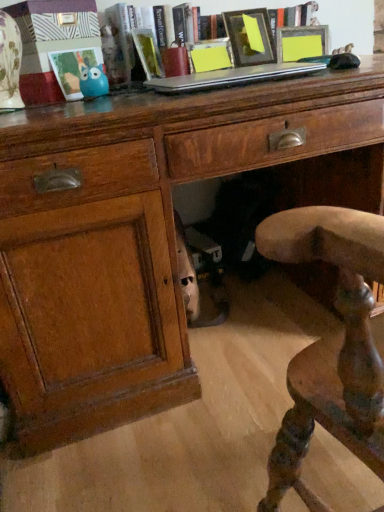
Question: Does matte black picture frame at upper center, acting as the first picture frame starting from the right, have a lesser width compared to silver metallic laptop at upper center?

Choices:
 (A) yes
 (B) no

Answer: (A)

Question: Is matte black picture frame at upper center, acting as the first picture frame starting from the right, to the right of silver metallic laptop at upper center from the viewer's perspective?

Choices:
 (A) yes
 (B) no

Answer: (A)

Question: Considering the relative positions of matte black picture frame at upper center, acting as the first picture frame starting from the right, and silver metallic laptop at upper center in the image provided, is matte black picture frame at upper center, acting as the first picture frame starting from the right, in front of silver metallic laptop at upper center?

Choices:
 (A) yes
 (B) no

Answer: (B)

Question: From the image's perspective, is matte black picture frame at upper center, acting as the first picture frame starting from the right, below silver metallic laptop at upper center?

Choices:
 (A) no
 (B) yes

Answer: (A)

Question: Does matte black picture frame at upper center, acting as the first picture frame starting from the right, have a greater height compared to silver metallic laptop at upper center?

Choices:
 (A) no
 (B) yes

Answer: (B)

Question: Is point (153, 57) closer or farther from the camera than point (208, 66)?

Choices:
 (A) closer
 (B) farther

Answer: (B)

Question: Considering the relative positions of hardcover book at center, positioned as the 2th book in right-to-left order, and matte yellow picture frame at center, which is the second picture frame from left to right, in the image provided, is hardcover book at center, positioned as the 2th book in right-to-left order, to the left or to the right of matte yellow picture frame at center, which is the second picture frame from left to right,?

Choices:
 (A) left
 (B) right

Answer: (A)

Question: From the image's perspective, is hardcover book at center, acting as the first book starting from the left, positioned above or below matte yellow picture frame at center, which is the second picture frame from left to right?

Choices:
 (A) above
 (B) below

Answer: (A)

Question: In terms of width, does hardcover book at center, positioned as the 2th book in right-to-left order, look wider or thinner when compared to matte yellow picture frame at center, which is the second picture frame from left to right?

Choices:
 (A) wide
 (B) thin

Answer: (A)

Question: Is point pos(241,44) closer or farther from the camera than point pos(97,48)?

Choices:
 (A) farther
 (B) closer

Answer: (A)

Question: From the image's perspective, is matte black picture frame at upper center, acting as the first picture frame starting from the right, positioned above or below matte plastic picture frame at upper left, the 3th picture frame from the right?

Choices:
 (A) below
 (B) above

Answer: (B)

Question: In terms of height, does matte black picture frame at upper center, acting as the first picture frame starting from the right, look taller or shorter compared to matte plastic picture frame at upper left, placed as the first picture frame when sorted from left to right?

Choices:
 (A) short
 (B) tall

Answer: (B)

Question: Visually, is matte black picture frame at upper center, which appears as the third picture frame when viewed from the left, positioned to the left or to the right of matte plastic picture frame at upper left, the 3th picture frame from the right?

Choices:
 (A) left
 (B) right

Answer: (B)

Question: Relative to matte yellow picture frame at center, which is the second picture frame from left to right, is hardcover book at upper center, positioned as the first book in right-to-left order, in front or behind?

Choices:
 (A) behind
 (B) front

Answer: (B)

Question: Is hardcover book at upper center, positioned as the first book in right-to-left order, inside the boundaries of matte yellow picture frame at center, the second picture frame in the right-to-left sequence, or outside?

Choices:
 (A) inside
 (B) outside

Answer: (B)